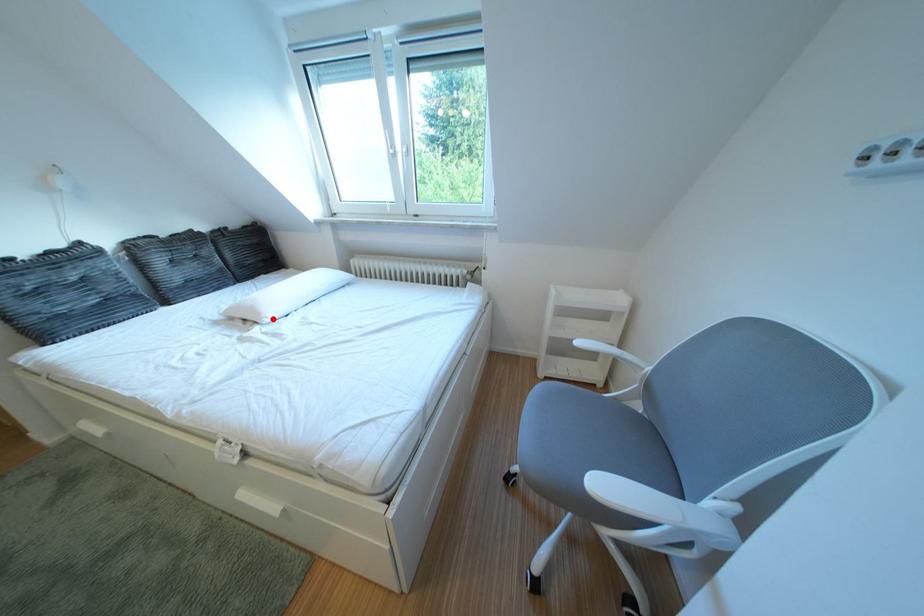
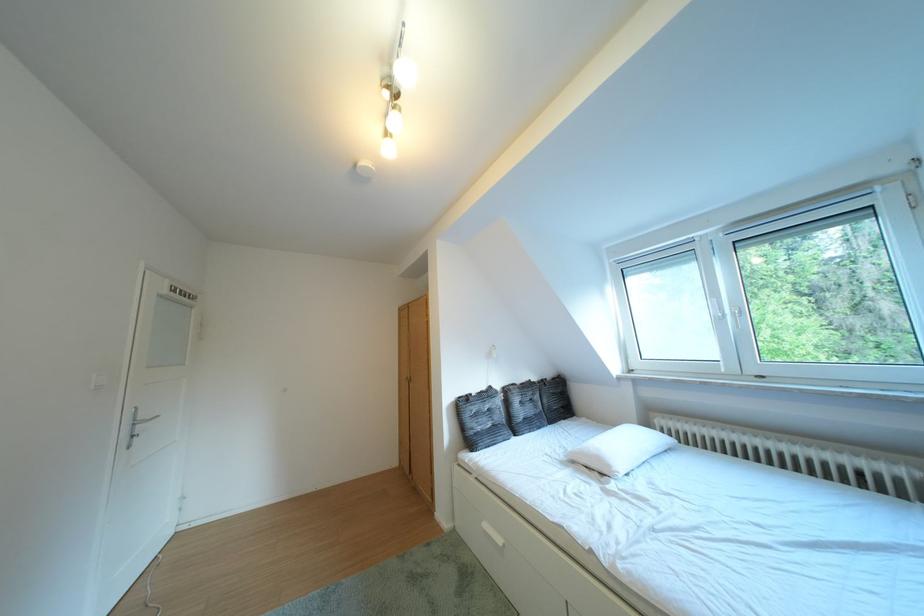
Find the pixel in the second image that matches the highlighted location in the first image.

(623, 471)